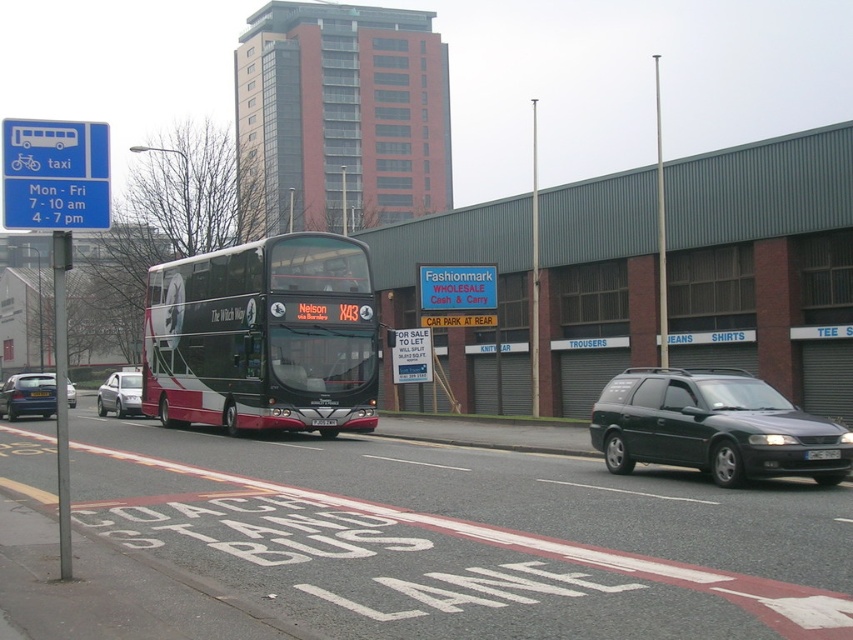
What is the purpose of the blue plastic sign at upper left marked by point (54,173)?

The blue plastic sign at upper left marked by point (54,173) indicates taxi operating hours and a coach stand bus lane.